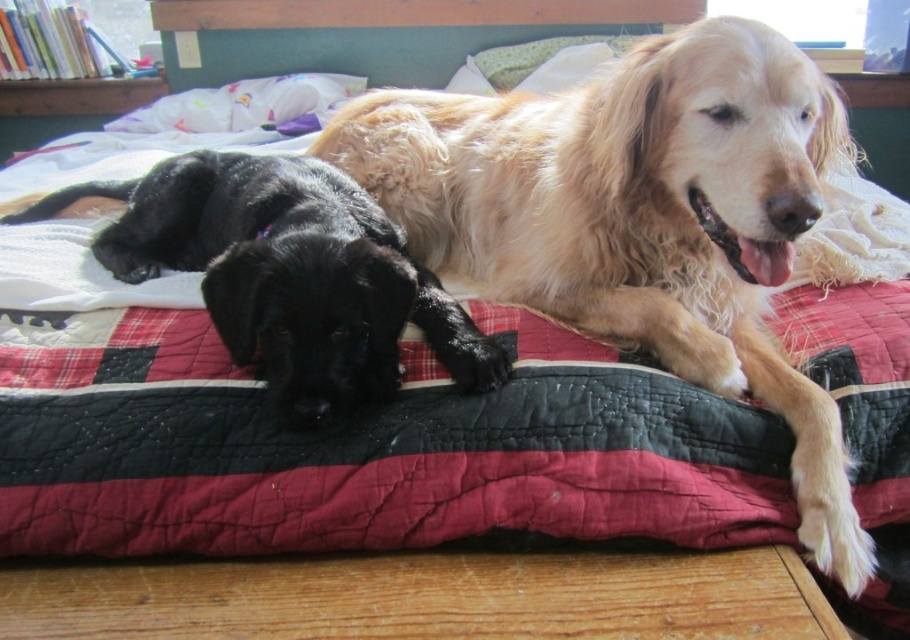
This screenshot has height=640, width=910. What do you see at coordinates (638, 218) in the screenshot?
I see `golden fur dog at upper center` at bounding box center [638, 218].

Who is more forward, (787, 394) or (273, 182)?

Point (787, 394)

Is point (531, 227) less distant than point (350, 298)?

No, (531, 227) is further to viewer.

Find the location of a particular element. This screenshot has width=910, height=640. golden fur dog at upper center is located at coordinates (638, 218).